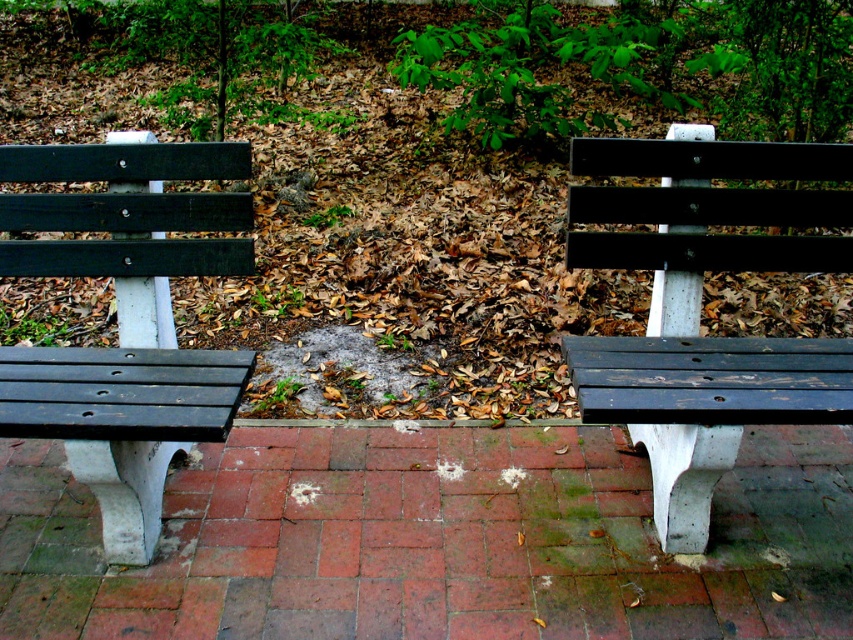
You are standing at the origin point in the park and want to place a new bench exactly halfway between the current benches. Given the coordinates of the matte black bench at right, can you determine the coordinates where the new bench should be placed?

The coordinates of the new bench should be the midpoint between the current benches. Since the matte black bench at right is at point (x=704, y=216), and assuming the other bench is at a symmetrical position, the midpoint would be calculated by averaging the coordinates. However, without the coordinates of the other bench, an exact calculation is not possible. Please provide the coordinates of the other bench to determine the exact midpoint.

You are standing at the point with coordinates point (39,362) and want to walk to the point with coordinates point (755,252). Based on the scene description, will you have to walk forward or backward to reach your destination?

Based on the scene description, point (755,252) is behind point (39,362). Therefore, to reach point (755,252) from point (39,362), you would need to walk backward.

You are a maintenance worker needing to place a 36 inch long tool between the two benches. Can you fit it between the matte black bench at right and the matte black bench at left?

The distance between the matte black bench at right and the matte black bench at left is 36.53 inches. Since the tool is 36 inches long, it will fit with a little extra space remaining.